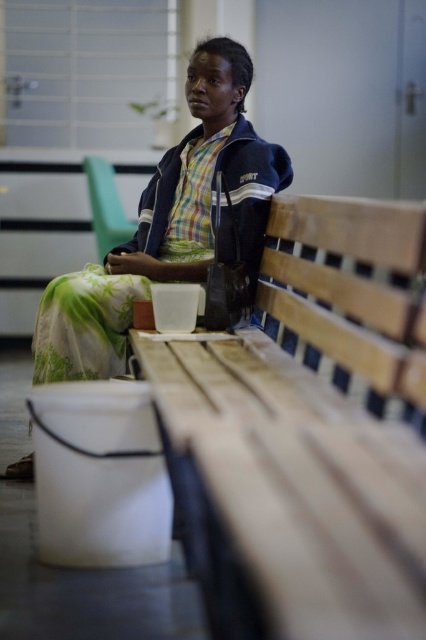
Question: Observing the image, what is the correct spatial positioning of wooden bench at center in reference to matte black jacket at center?

Choices:
 (A) left
 (B) right

Answer: (B)

Question: Considering the relative positions of wooden bench at center and matte black jacket at center in the image provided, where is wooden bench at center located with respect to matte black jacket at center?

Choices:
 (A) right
 (B) left

Answer: (A)

Question: Which point is closer to the camera?

Choices:
 (A) wooden bench at center
 (B) matte black jacket at center

Answer: (A)

Question: Which point is closer to the camera taking this photo?

Choices:
 (A) (261, 630)
 (B) (36, 360)

Answer: (A)

Question: Is wooden bench at center thinner than matte black jacket at center?

Choices:
 (A) no
 (B) yes

Answer: (B)

Question: Which object appears farthest from the camera in this image?

Choices:
 (A) matte black jacket at center
 (B) wooden bench at center

Answer: (A)